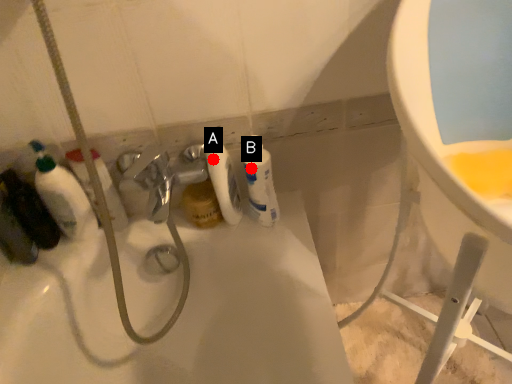
Question: Two points are circled on the image, labeled by A and B beside each circle. Which point is farther to the camera?

Choices:
 (A) A is further
 (B) B is further

Answer: (B)